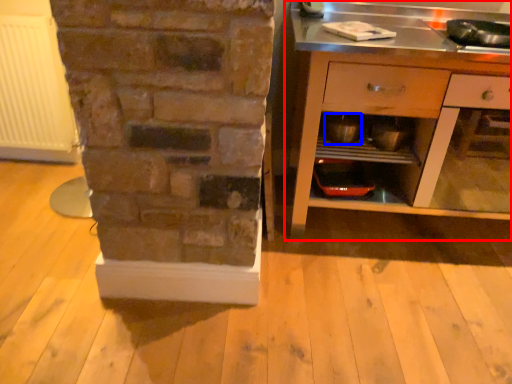
Question: Among these objects, which one is farthest to the camera, cabinetry (highlighted by a red box) or appliance (highlighted by a blue box)?

Choices:
 (A) cabinetry
 (B) appliance

Answer: (B)